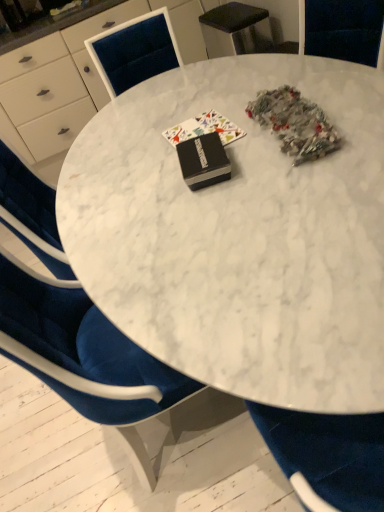
Question: Is black matte book at center, which is counted as the 2th book, starting from the front, oriented towards white marble table at center?

Choices:
 (A) no
 (B) yes

Answer: (B)

Question: Is black matte book at center, which appears as the first book when viewed from the back, at the right side of white marble table at center?

Choices:
 (A) yes
 (B) no

Answer: (B)

Question: Does black matte book at center, which appears as the first book when viewed from the back, have a smaller size compared to white marble table at center?

Choices:
 (A) yes
 (B) no

Answer: (A)

Question: From the image's perspective, is black matte book at center, which is counted as the 2th book, starting from the front, under white marble table at center?

Choices:
 (A) yes
 (B) no

Answer: (B)

Question: From the image's perspective, does black matte book at center, which is counted as the 2th book, starting from the front, appear higher than white marble table at center?

Choices:
 (A) no
 (B) yes

Answer: (B)

Question: From the image's perspective, is black matte book at center, which appears as the first book when viewed from the back, above or below white marble table at center?

Choices:
 (A) above
 (B) below

Answer: (A)

Question: Considering the positions of black matte book at center, which appears as the first book when viewed from the back, and white marble table at center in the image, is black matte book at center, which appears as the first book when viewed from the back, bigger or smaller than white marble table at center?

Choices:
 (A) big
 (B) small

Answer: (B)

Question: Is black matte book at center, which is counted as the 2th book, starting from the front, in front of or behind white marble table at center in the image?

Choices:
 (A) front
 (B) behind

Answer: (B)

Question: Is point (223, 123) positioned closer to the camera than point (160, 217)?

Choices:
 (A) closer
 (B) farther

Answer: (B)

Question: Considering the positions of black matte book at center, which ranks as the second book in back-to-front order, and white marble table at center in the image, is black matte book at center, which ranks as the second book in back-to-front order, wider or thinner than white marble table at center?

Choices:
 (A) wide
 (B) thin

Answer: (B)

Question: Would you say black matte book at center, placed as the 1th book when sorted from front to back, is to the left or to the right of white marble table at center in the picture?

Choices:
 (A) right
 (B) left

Answer: (B)

Question: Considering the positions of black matte book at center, placed as the 1th book when sorted from front to back, and white marble table at center in the image, is black matte book at center, placed as the 1th book when sorted from front to back, bigger or smaller than white marble table at center?

Choices:
 (A) big
 (B) small

Answer: (B)

Question: Choose the correct answer: Is black matte book at center, which ranks as the second book in back-to-front order, inside white marble table at center or outside it?

Choices:
 (A) inside
 (B) outside

Answer: (B)

Question: From the image's perspective, is black matte book at center, which is counted as the 2th book, starting from the front, above or below black matte book at center, placed as the 1th book when sorted from front to back?

Choices:
 (A) below
 (B) above

Answer: (B)

Question: In the image, is black matte book at center, which is counted as the 2th book, starting from the front, positioned in front of or behind black matte book at center, placed as the 1th book when sorted from front to back?

Choices:
 (A) front
 (B) behind

Answer: (B)